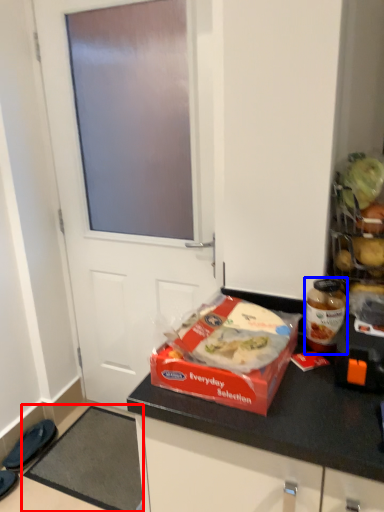
Question: Among these objects, which one is farthest to the camera, doormat (highlighted by a red box) or bottle (highlighted by a blue box)?

Choices:
 (A) doormat
 (B) bottle

Answer: (A)